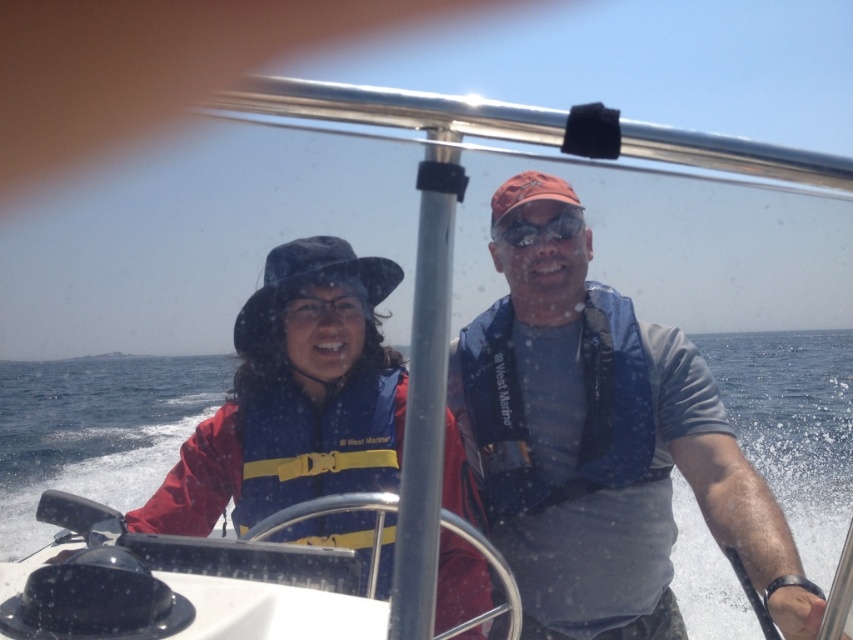
You are a drone operator trying to locate the blue fabric life vest at center on the boat. According to the coordinates provided, where would you direct the drone to look?

The blue fabric life vest at center is located at coordinates point (605, 456).

You are a safety inspector checking the boat for proper life vest placement. You notice two blue life vests at center. Which one is closer to you, the blue fabric life vest at center or the blue life vest at center?

The blue fabric life vest at center is closer to you because it is in front of the blue life vest at center.